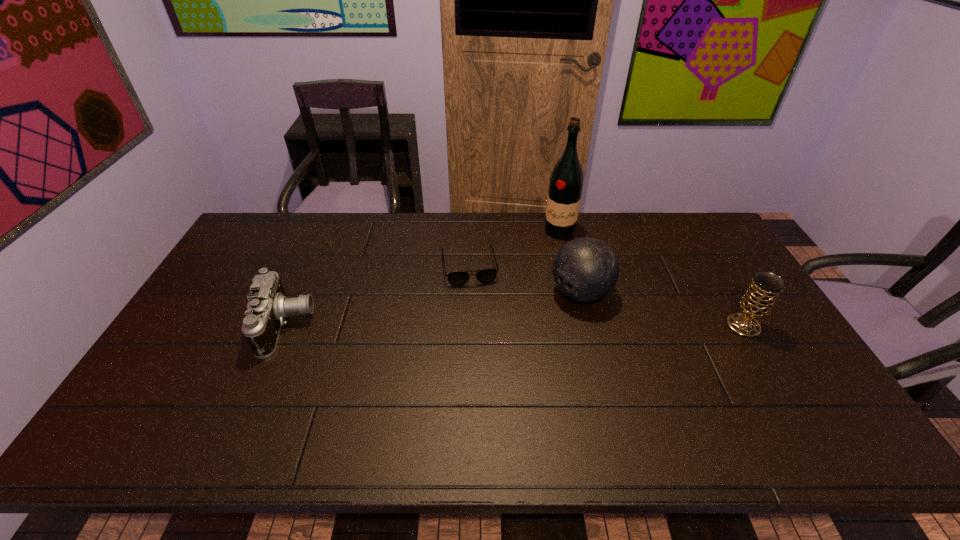
Find the location of a particular element. vacant space located on the grip area of the bowling ball is located at coordinates (454, 381).

Identify the location of vacant space located on the grip area of the bowling ball. This screenshot has width=960, height=540. (472, 369).

Where is `vacant space situated 0.270m on the grip area of the bowling ball`? The width and height of the screenshot is (960, 540). vacant space situated 0.270m on the grip area of the bowling ball is located at coordinates (492, 355).

Where is `vacant area located on the front-facing side of the shortest object`? This screenshot has width=960, height=540. vacant area located on the front-facing side of the shortest object is located at coordinates (485, 348).

The width and height of the screenshot is (960, 540). Identify the location of vacant region located 0.370m on the front-facing side of the shortest object. (492, 385).

Where is `free space located on the front-facing side of the shortest object`? This screenshot has width=960, height=540. free space located on the front-facing side of the shortest object is located at coordinates (487, 357).

Identify the location of vacant space located on the front-facing side of the tallest object. (552, 259).

The image size is (960, 540). In order to click on vacant space located 0.220m on the front-facing side of the tallest object in this screenshot , I will do `click(545, 280)`.

This screenshot has height=540, width=960. What are the coordinates of `vacant space located on the front-facing side of the tallest object` in the screenshot? It's located at (537, 313).

Where is `spectacles at the far edge`? spectacles at the far edge is located at coordinates (485, 276).